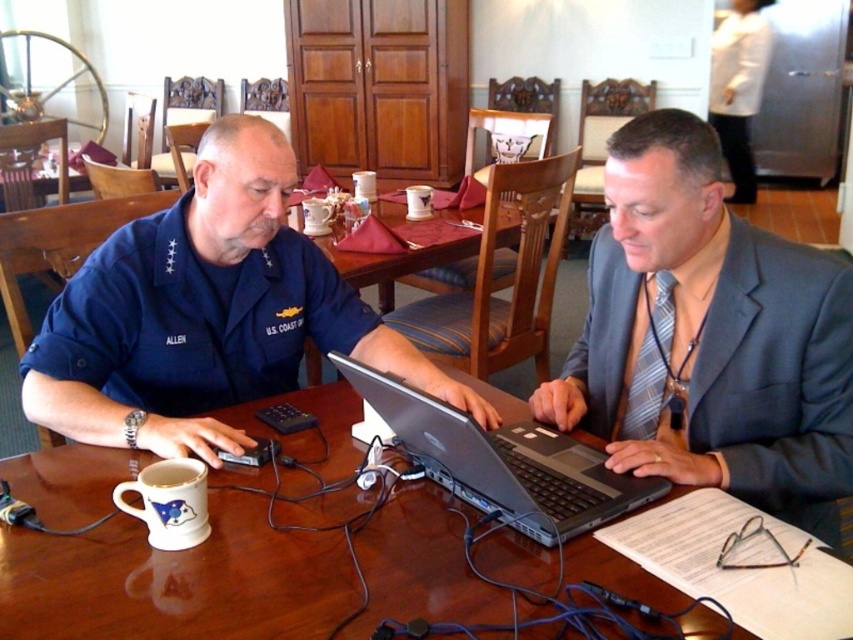
Is point (28, 477) closer to viewer compared to point (294, 321)?

Yes, point (28, 477) is in front of point (294, 321).

Between point (39, 515) and point (201, 266), which one is positioned behind?

The point (201, 266) is behind.

The height and width of the screenshot is (640, 853). I want to click on brown wooden table at center, so (x=177, y=580).

Is point (454, 211) closer to viewer compared to point (663, 349)?

No, it is not.

Identify the location of wooden table at center. (407, 248).

Where is `wooden table at center`? wooden table at center is located at coordinates (407, 248).

The image size is (853, 640). I want to click on brown wooden table at center, so click(177, 580).

Is brown wooden table at center closer to the viewer compared to wooden table at center?

Yes, it is.

Between point (299, 536) and point (467, 212), which one is positioned behind?

Point (467, 212)

I want to click on brown wooden table at center, so click(x=177, y=580).